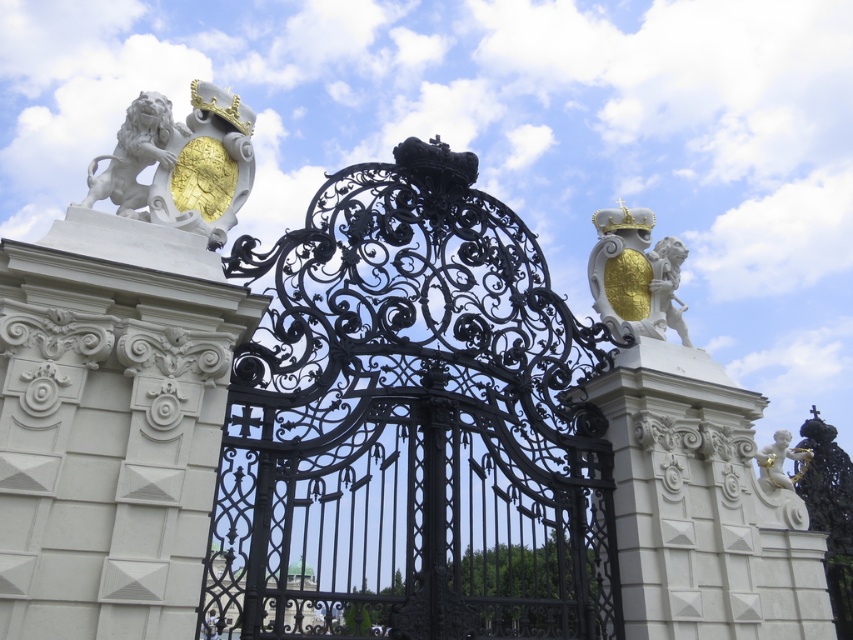
You are an architect designing a new gate and want to ensure symmetry between the white stone lion at upper left and the gold metallic cherub at right. Given their sizes, which one should you adjust to achieve balance?

The white stone lion at upper left occupies less space than the gold metallic cherub at right, so you should enlarge the white stone lion at upper left to match the size of the gold metallic cherub at right for better symmetry.

You are standing at the entrance of the grand estate and notice a specific point marked at coordinates (134, 154). What object is located at that exact point?

The white marble lion at upper left is located at point (134, 154).

Consider the image. You are standing at the entrance of the estate and notice a specific point marked at coordinates [181,163]. Which object is this point located on?

The point is located on the white stone lion at upper left.